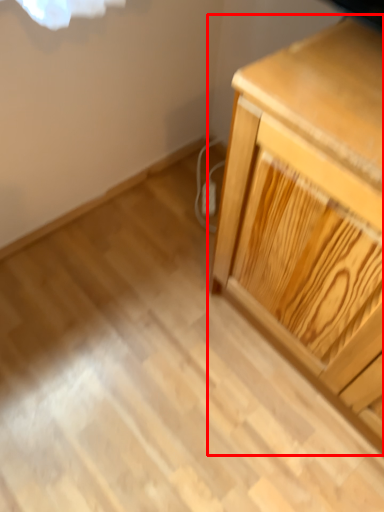
Question: From the image's perspective, considering the relative positions of chest of drawers (annotated by the red box) and electric outlet in the image provided, where is chest of drawers (annotated by the red box) located with respect to the staircase?

Choices:
 (A) below
 (B) above

Answer: (A)